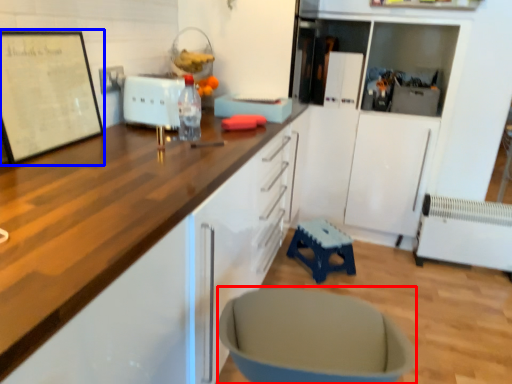
Question: Which object appears closest to the camera in this image, swivel chair (highlighted by a red box) or bulletin board (highlighted by a blue box)?

Choices:
 (A) swivel chair
 (B) bulletin board

Answer: (A)